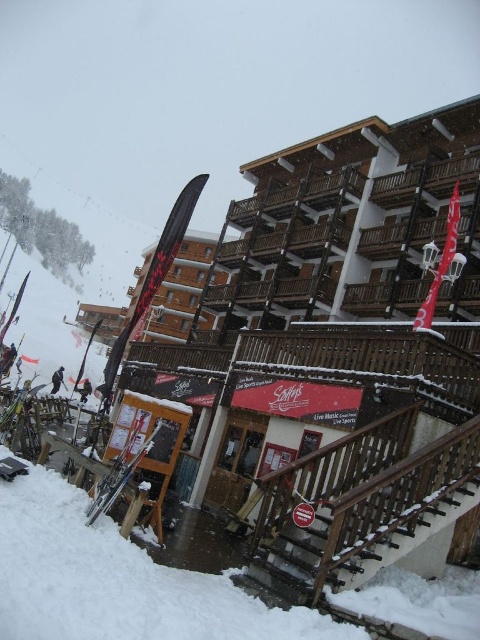
Question: From the image, what is the correct spatial relationship of black glossy ski at center in relation to dark gray ski at lower left?

Choices:
 (A) right
 (B) left

Answer: (A)

Question: Does metallic skis at lower left lie behind dark gray ski at lower left?

Choices:
 (A) yes
 (B) no

Answer: (B)

Question: Which of these objects is positioned farthest from the dark gray ski at lower left?

Choices:
 (A) dark gray snowboarder at lower left
 (B) black glossy ski at center

Answer: (B)

Question: Which point appears farthest from the camera in this image?

Choices:
 (A) (134, 426)
 (B) (83, 397)
 (C) (61, 368)
 (D) (157, 244)

Answer: (C)

Question: Among these points, which one is nearest to the camera?

Choices:
 (A) (167, 224)
 (B) (56, 385)
 (C) (134, 468)

Answer: (C)

Question: Does black glossy ski at center have a lesser width compared to dark gray snowboarder at lower left?

Choices:
 (A) yes
 (B) no

Answer: (B)